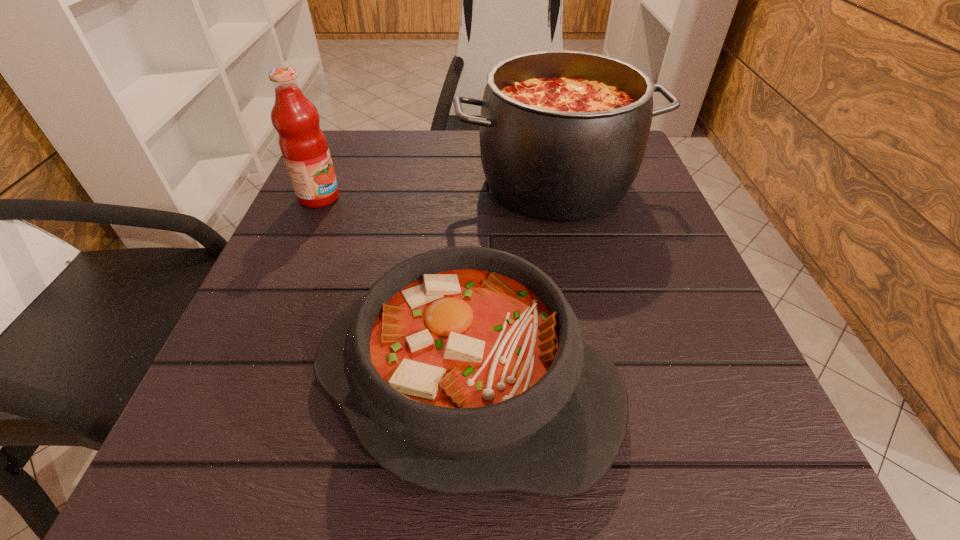
At what (x,y) coordinates should I click in order to perform the action: click on fruit juice located in the left edge section of the desktop. Please return your answer as a coordinate pair (x, y). The width and height of the screenshot is (960, 540). Looking at the image, I should click on (303, 145).

Locate an element on the screen. The width and height of the screenshot is (960, 540). casserole that is at the left edge is located at coordinates (463, 370).

Locate an element on the screen. The image size is (960, 540). object that is positioned at the right edge is located at coordinates (563, 134).

Where is `object that is at the far left corner`? The width and height of the screenshot is (960, 540). object that is at the far left corner is located at coordinates (303, 145).

Identify the location of object that is at the near left corner. (463, 370).

At what (x,y) coordinates should I click in order to perform the action: click on object that is at the far right corner. Please return your answer as a coordinate pair (x, y). The height and width of the screenshot is (540, 960). Looking at the image, I should click on (563, 134).

At what (x,y) coordinates should I click in order to perform the action: click on free location at the far edge of the desktop. Please return your answer as a coordinate pair (x, y). This screenshot has width=960, height=540. Looking at the image, I should click on (430, 172).

At what (x,y) coordinates should I click in order to perform the action: click on vacant space at the left edge of the desktop. Please return your answer as a coordinate pair (x, y). Image resolution: width=960 pixels, height=540 pixels. Looking at the image, I should click on (264, 312).

Where is `vacant space at the right edge of the desktop`? vacant space at the right edge of the desktop is located at coordinates (677, 323).

This screenshot has height=540, width=960. I want to click on free space at the far left corner of the desktop, so click(x=384, y=142).